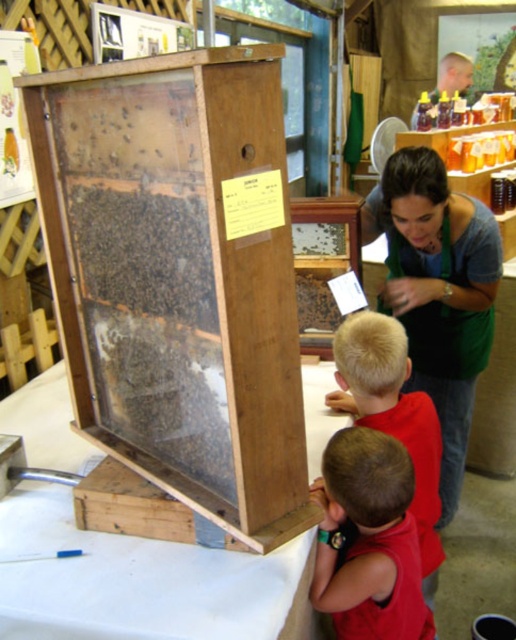
Looking at this image, between black fuzzy bee at center and translucent wood honeycomb at center, which one is positioned lower?

translucent wood honeycomb at center is lower down.

Who is shorter, black fuzzy bee at center or translucent wood honeycomb at center?

translucent wood honeycomb at center is shorter.

The height and width of the screenshot is (640, 516). Describe the element at coordinates (124, 112) in the screenshot. I see `black fuzzy bee at center` at that location.

Locate an element on the screen. This screenshot has width=516, height=640. black fuzzy bee at center is located at coordinates (124, 112).

Does smooth skin head at upper right appear on the left side of translucent wood bee at center?

In fact, smooth skin head at upper right is to the right of translucent wood bee at center.

What do you see at coordinates (453, 76) in the screenshot? This screenshot has height=640, width=516. I see `smooth skin head at upper right` at bounding box center [453, 76].

Is point (461, 92) in front of point (158, 157)?

No, it is not.

I want to click on smooth skin head at upper right, so click(453, 76).

Does translucent wood honeycomb at center lie in front of translucent wood bee at center?

No, it is behind translucent wood bee at center.

Who is more forward, (x=132, y=136) or (x=160, y=150)?

Point (x=160, y=150) is more forward.

Is point (123, 131) behind point (160, 154)?

Yes.

Locate an element on the screen. translucent wood honeycomb at center is located at coordinates (125, 134).